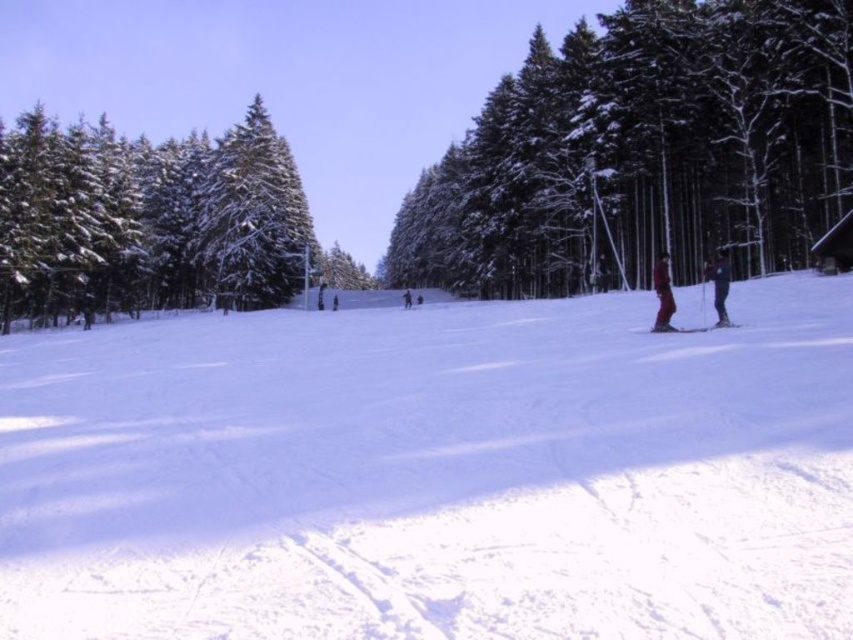
You are a photographer trying to capture both the dark blue ski pants at right and the red fabric skier at right in a single shot. Which of the two objects should you focus on first to ensure they are both in clear focus?

The dark blue ski pants at right is bigger than the red fabric skier at right, so focusing on the dark blue ski pants at right first will help ensure both are in clear focus since it is closer to the camera.

You are a photographer positioned at the center of the ski slope. You want to capture a photo of the dark blue ski pants at right. Where should you aim your camera to include them in the frame?

You should aim your camera towards the right side of the frame at coordinates approximately 0.442 on the x axis and 0.844 on the y axis to capture the dark blue ski pants at right.

You are a photographer standing on the ski slope and want to capture both the white powdery snow at center and the dark blue ski pants at right in the same photo. Which object will appear larger in the photo?

The white powdery snow at center will appear larger in the photo because it is closer to the viewer than the dark blue ski pants at right.